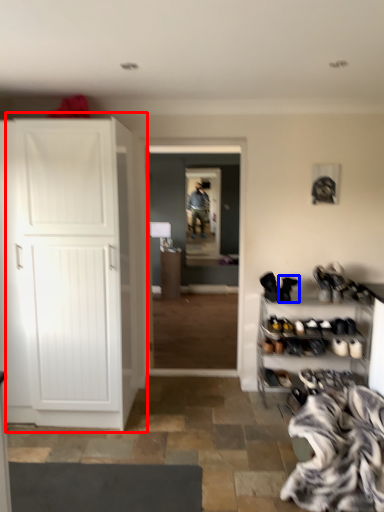
Question: Among these objects, which one is farthest to the camera, cupboard (highlighted by a red box) or footwear (highlighted by a blue box)?

Choices:
 (A) cupboard
 (B) footwear

Answer: (B)